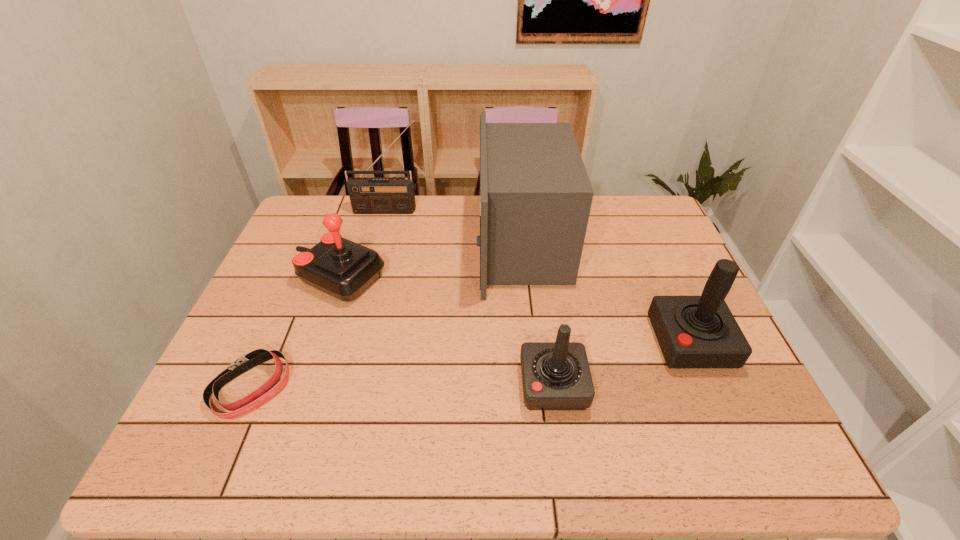
Where is `blank region between the shortest joystick and the dog collar`? The width and height of the screenshot is (960, 540). blank region between the shortest joystick and the dog collar is located at coordinates (402, 386).

In order to click on empty space that is in between the shortest object and the leftmost joystick in this screenshot , I will do `click(295, 333)`.

Where is `free space between the fifth tallest object and the rightmost joystick`? free space between the fifth tallest object and the rightmost joystick is located at coordinates (622, 363).

Locate an element on the screen. This screenshot has height=540, width=960. free area in between the rightmost object and the dog collar is located at coordinates (470, 365).

At what (x,y) coordinates should I click in order to perform the action: click on free space between the shortest object and the radio receiver. Please return your answer as a coordinate pair (x, y). This screenshot has height=540, width=960. Looking at the image, I should click on (320, 299).

In order to click on vacant area between the shortest object and the radio receiver in this screenshot , I will do `click(320, 299)`.

Where is `unoccupied position between the radio receiver and the shortest object`? Image resolution: width=960 pixels, height=540 pixels. unoccupied position between the radio receiver and the shortest object is located at coordinates (320, 299).

Identify the location of free point between the microwave oven and the radio receiver. (455, 226).

Select which object is the second closest to the radio receiver. Please provide its 2D coordinates. Your answer should be formatted as a tuple, i.e. [(x, y)], where the tuple contains the x and y coordinates of a point satisfying the conditions above.

[(343, 269)]

Locate which object is the third closest to the rightmost joystick. Please provide its 2D coordinates. Your answer should be formatted as a tuple, i.e. [(x, y)], where the tuple contains the x and y coordinates of a point satisfying the conditions above.

[(343, 269)]